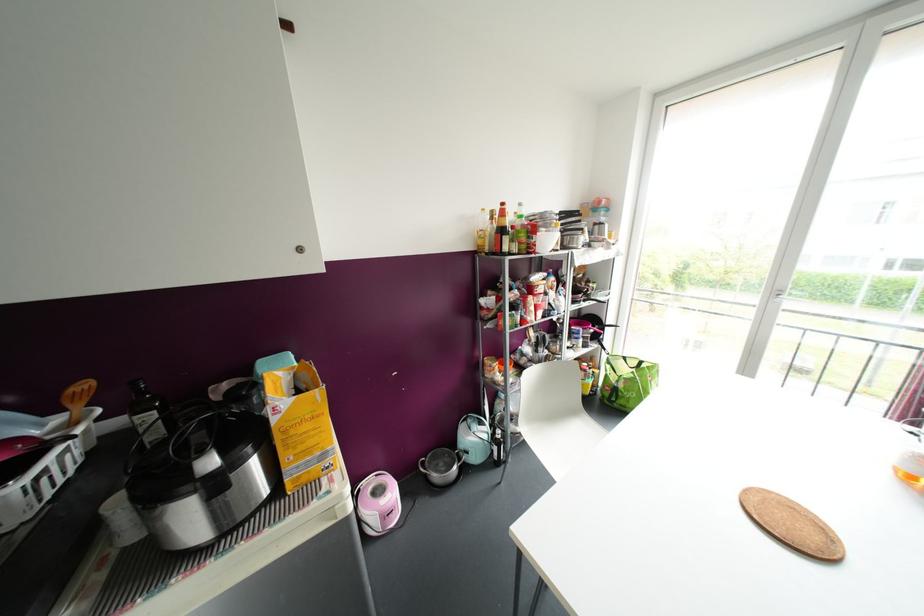
This screenshot has height=616, width=924. Identify the location of green shopping bag. (626, 381).